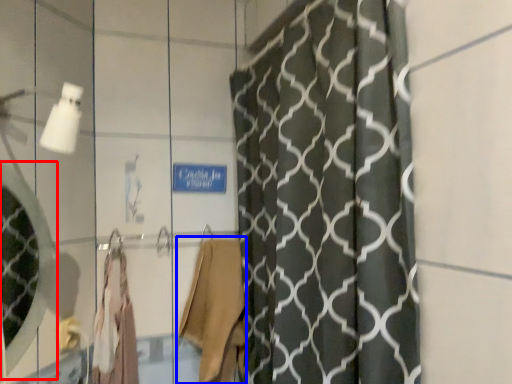
Question: Among these objects, which one is farthest to the camera, mirror (highlighted by a red box) or robe (highlighted by a blue box)?

Choices:
 (A) mirror
 (B) robe

Answer: (B)